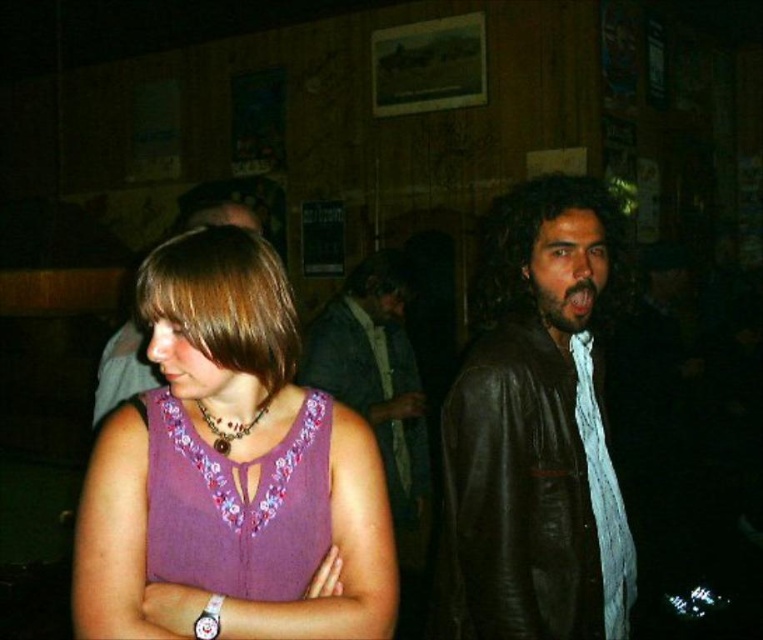
Which is more to the right, leather jacket at right or brown beaded necklace at center?

leather jacket at right is more to the right.

Does point (552, 452) lie in front of point (221, 426)?

No.

Between point (617, 573) and point (246, 433), which one is positioned in front?

Point (246, 433) is more forward.

Identify the location of leather jacket at right. (533, 429).

Is point (229, 368) closer to viewer compared to point (134, 362)?

Yes.

Between purple knit top at center and matte brown leather jacket at center, which one has more height?

purple knit top at center

Is point (208, 262) positioned before point (224, 220)?

That is True.

Locate an element on the screen. The image size is (763, 640). purple knit top at center is located at coordinates (229, 461).

Does matte brown leather jacket at center appear on the right side of brown beaded necklace at center?

No, matte brown leather jacket at center is not to the right of brown beaded necklace at center.

Which is below, matte brown leather jacket at center or brown beaded necklace at center?

Positioned lower is brown beaded necklace at center.

What do you see at coordinates (124, 362) in the screenshot? This screenshot has height=640, width=763. I see `matte brown leather jacket at center` at bounding box center [124, 362].

Where is `matte brown leather jacket at center`? This screenshot has height=640, width=763. matte brown leather jacket at center is located at coordinates (124, 362).